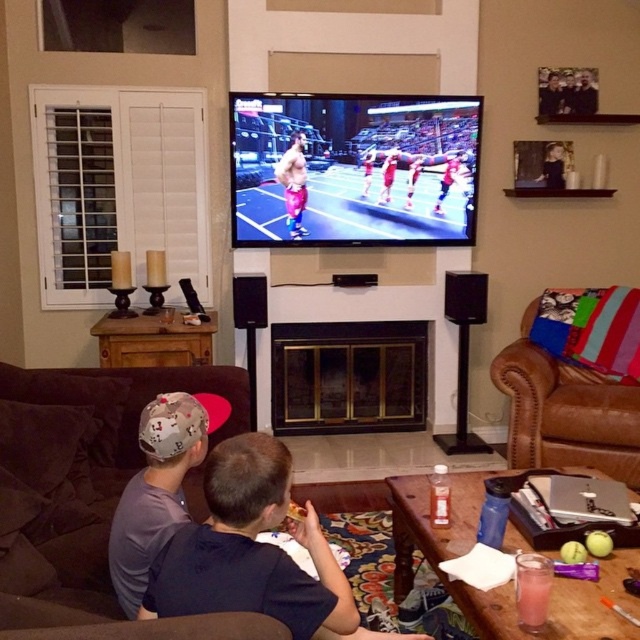
Question: Which of these objects is positioned closest to the gray fabric cap at left?

Choices:
 (A) brown fabric couch at lower left
 (B) brown leather couch at right
 (C) pink fabric shorts at center

Answer: (A)

Question: Observing the image, what is the correct spatial positioning of brown fabric couch at lower left in reference to gray fabric cap at left?

Choices:
 (A) above
 (B) below

Answer: (B)

Question: Is brown fabric couch at lower left above brown leather couch at right?

Choices:
 (A) no
 (B) yes

Answer: (A)

Question: Which point is closer to the camera taking this photo?

Choices:
 (A) (284, 172)
 (B) (580, 380)

Answer: (B)

Question: Is brown leather couch at right thinner than gray fabric cap at left?

Choices:
 (A) yes
 (B) no

Answer: (B)

Question: Among these points, which one is farthest from the camera?

Choices:
 (A) (292, 168)
 (B) (628, 481)
 (C) (150, 524)
 (D) (189, 621)

Answer: (A)